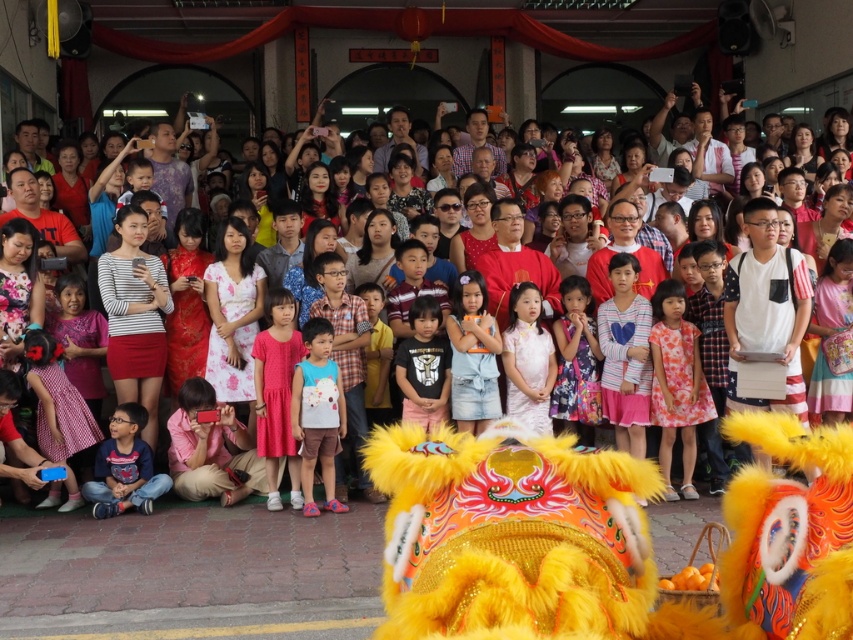
Question: Which of the following is the closest to the observer?

Choices:
 (A) pink cotton dress at center
 (B) black cotton shirt at center

Answer: (A)

Question: Can you confirm if white cotton shirt at center is positioned above black cotton shirt at center?

Choices:
 (A) no
 (B) yes

Answer: (A)

Question: Can you confirm if floral dress at center is smaller than white cotton shirt at center?

Choices:
 (A) yes
 (B) no

Answer: (B)

Question: Among these objects, which one is farthest from the camera?

Choices:
 (A) white cotton shirt at center
 (B) denim shorts at center
 (C) floral dress at center

Answer: (B)

Question: Does pink cotton dress at center have a larger size compared to matte pink dress at center?

Choices:
 (A) no
 (B) yes

Answer: (B)

Question: Which point is closer to the camera?

Choices:
 (A) (270, 372)
 (B) (671, 442)
 (C) (509, 404)

Answer: (A)